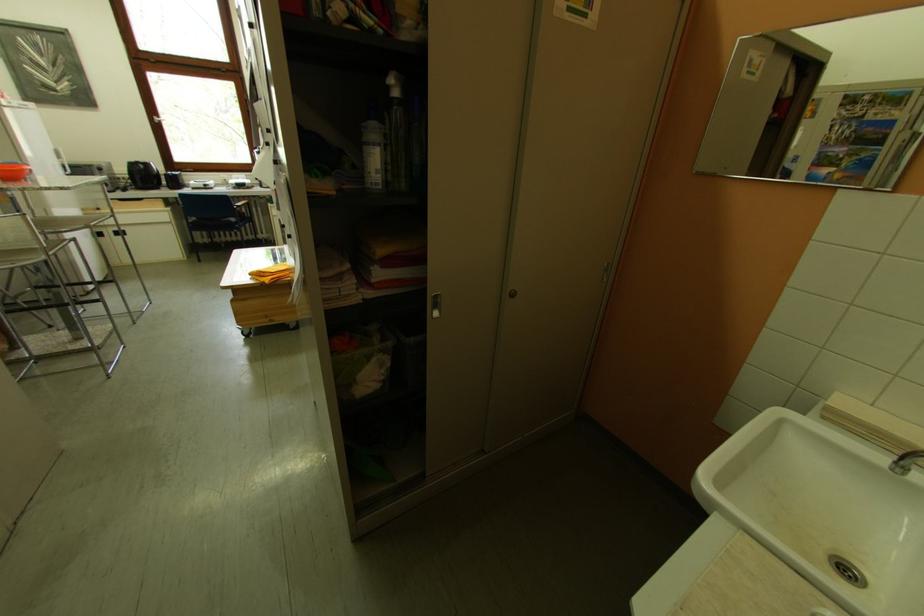
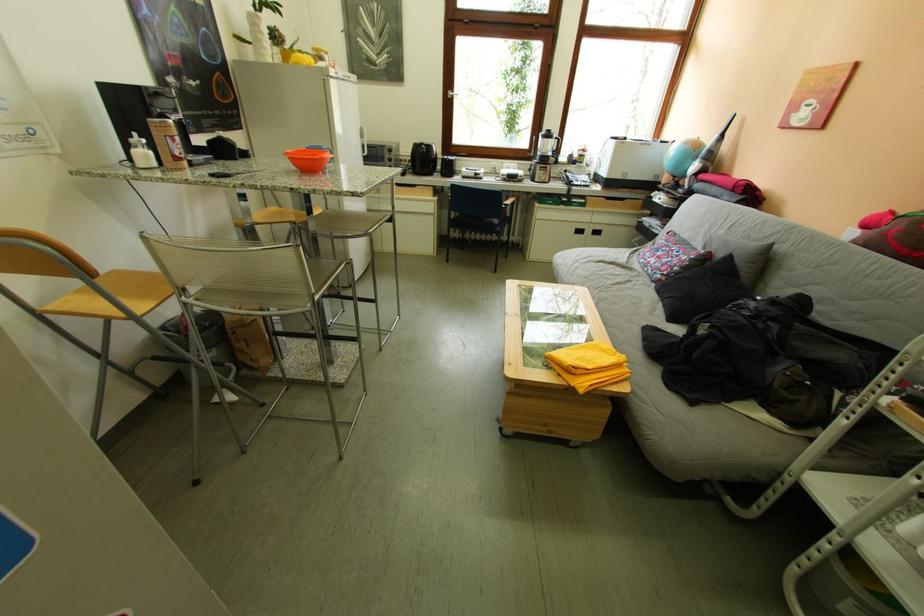
The point at (x=249, y=233) is marked in the first image. Where is the corresponding point in the second image?

(507, 238)